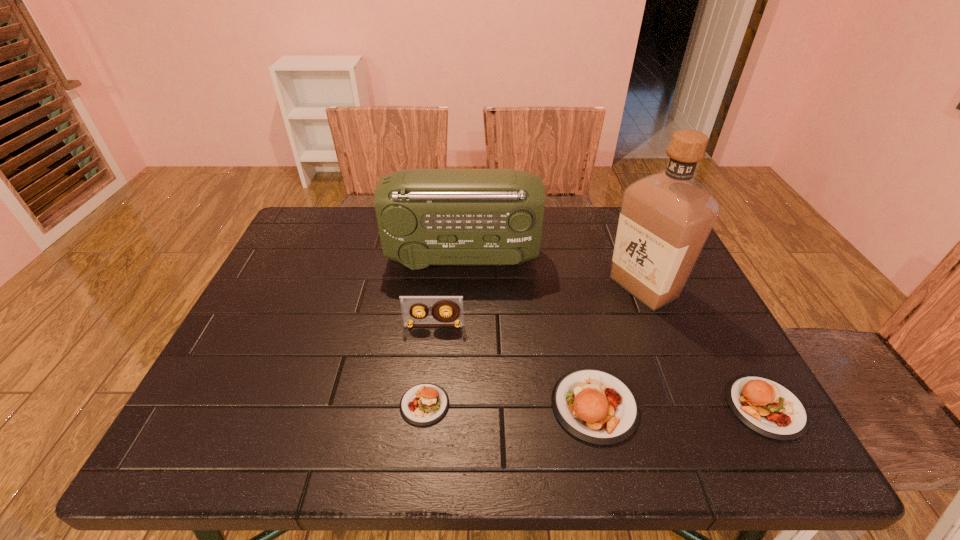
At what (x,y) coordinates should I click in order to perform the action: click on object at the near right corner. Please return your answer as a coordinate pair (x, y). This screenshot has height=540, width=960. Looking at the image, I should click on (767, 407).

In the image, there is a desktop. Identify the location of vacant region at the far edge. The width and height of the screenshot is (960, 540). tap(569, 227).

You are a GUI agent. You are given a task and a screenshot of the screen. Output one action in this format:
    pyautogui.click(x=<x>, y=<y>)
    Task: Click on the blank space at the near edge of the desktop
    This screenshot has width=960, height=540.
    Given the screenshot: What is the action you would take?
    pyautogui.click(x=295, y=390)

In the image, there is a desktop. In order to click on free space at the left edge in this screenshot , I will do `click(277, 354)`.

The width and height of the screenshot is (960, 540). In the image, there is a desktop. In order to click on blank space at the right edge in this screenshot , I will do `click(689, 285)`.

The height and width of the screenshot is (540, 960). In the image, there is a desktop. Find the location of `vacant space at the far left corner`. vacant space at the far left corner is located at coordinates (297, 239).

This screenshot has height=540, width=960. In the image, there is a desktop. In order to click on vacant space at the near left corner in this screenshot , I will do `click(271, 411)`.

At what (x,y) coordinates should I click in order to perform the action: click on vacant space at the near right corner of the desktop. Please return your answer as a coordinate pair (x, y). Looking at the image, I should click on (724, 393).

Locate an element on the screen. vacant area between the second patty (food) from left to right and the fourth shortest object is located at coordinates (515, 366).

This screenshot has height=540, width=960. I want to click on vacant space that is in between the radio_receiver and the second tallest patty (food), so [x=613, y=333].